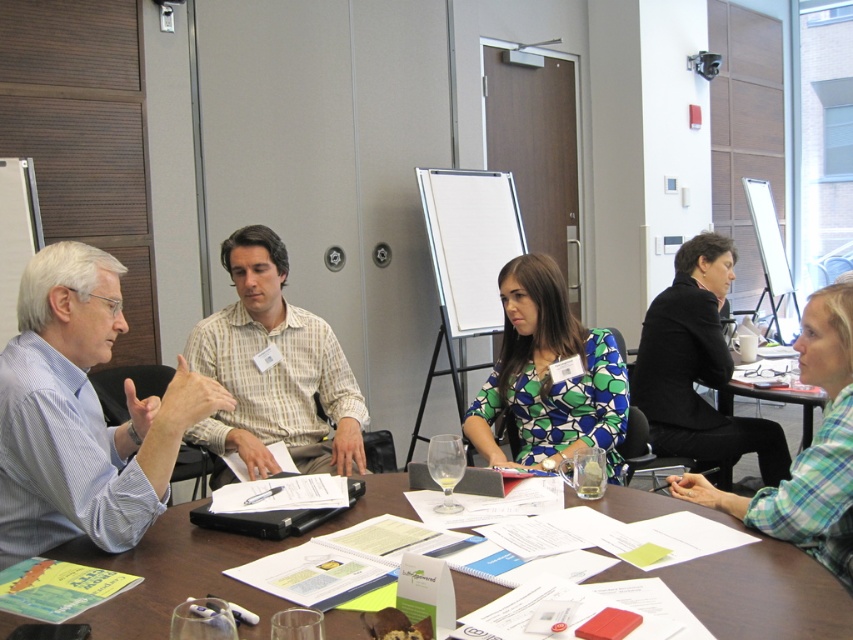
Question: Which point is farther to the camera?

Choices:
 (A) green printed blouse at center
 (B) blue striped shirt at left
 (C) black matte jacket at upper right

Answer: (C)

Question: Considering the relative positions of light brown striped shirt at center and green plaid shirt at lower right in the image provided, where is light brown striped shirt at center located with respect to green plaid shirt at lower right?

Choices:
 (A) left
 (B) right

Answer: (A)

Question: Which object is the farthest from the green plaid shirt at lower right?

Choices:
 (A) blue striped shirt at left
 (B) light brown striped shirt at center

Answer: (A)

Question: Is white paper at center further to the viewer compared to green printed blouse at center?

Choices:
 (A) no
 (B) yes

Answer: (A)

Question: Does black matte jacket at upper right come in front of green plaid shirt at lower right?

Choices:
 (A) no
 (B) yes

Answer: (A)

Question: Which object is positioned farthest from the light brown striped shirt at center?

Choices:
 (A) green plaid shirt at lower right
 (B) black matte jacket at upper right

Answer: (B)